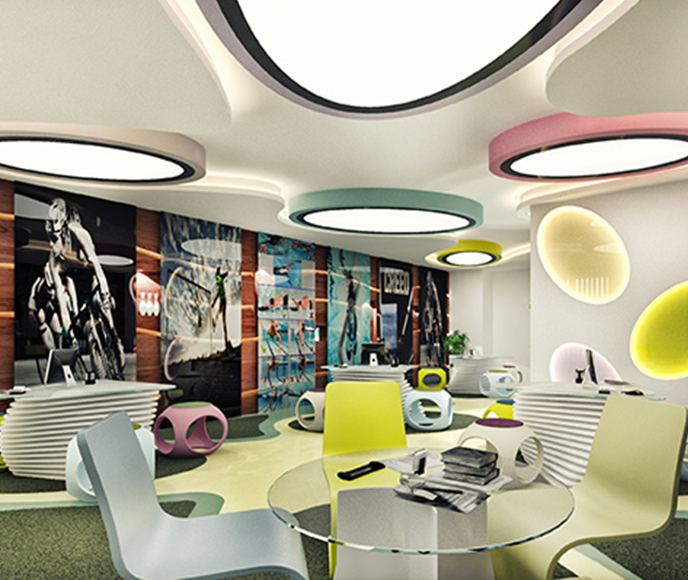
You are a GUI agent. You are given a task and a screenshot of the screen. Output one action in this format:
    pyautogui.click(x=<x>, y=<y>)
    Task: Click on the chairs
    Image resolution: width=688 pixels, height=580 pixels.
    Given the screenshot: What is the action you would take?
    pyautogui.click(x=120, y=529), pyautogui.click(x=356, y=414), pyautogui.click(x=619, y=474)